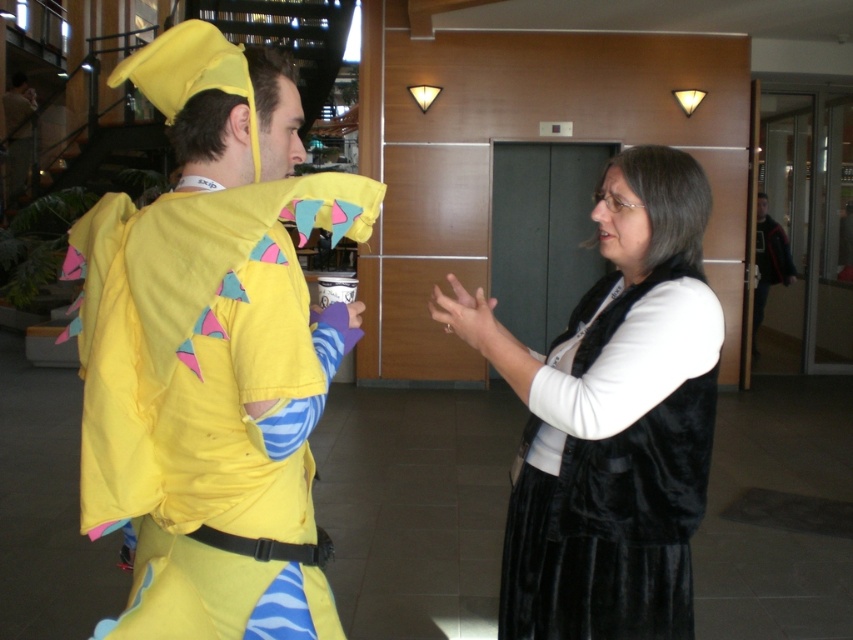
Question: Does matte yellow costume at left come in front of dark gray sweater at right?

Choices:
 (A) yes
 (B) no

Answer: (A)

Question: Which of the following is the farthest from the observer?

Choices:
 (A) dark gray sweater at right
 (B) matte yellow costume at left

Answer: (A)

Question: Does matte yellow costume at left have a lesser width compared to dark gray sweater at right?

Choices:
 (A) no
 (B) yes

Answer: (B)

Question: Which point appears farthest from the camera in this image?

Choices:
 (A) (508, 627)
 (B) (764, 296)

Answer: (B)

Question: Is velvet black vest at center bigger than dark gray sweater at right?

Choices:
 (A) no
 (B) yes

Answer: (A)

Question: Which object is closer to the camera taking this photo?

Choices:
 (A) velvet black vest at center
 (B) dark gray sweater at right

Answer: (A)